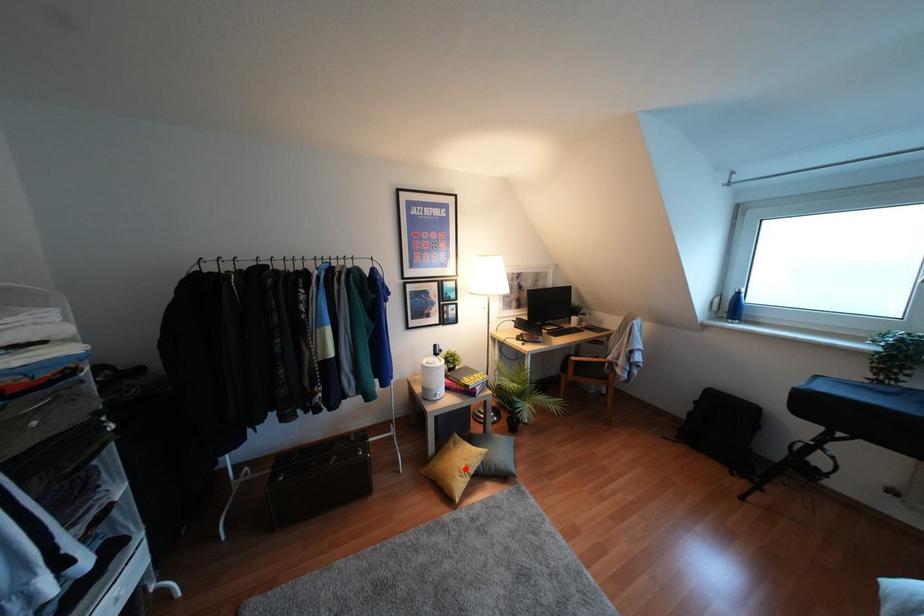
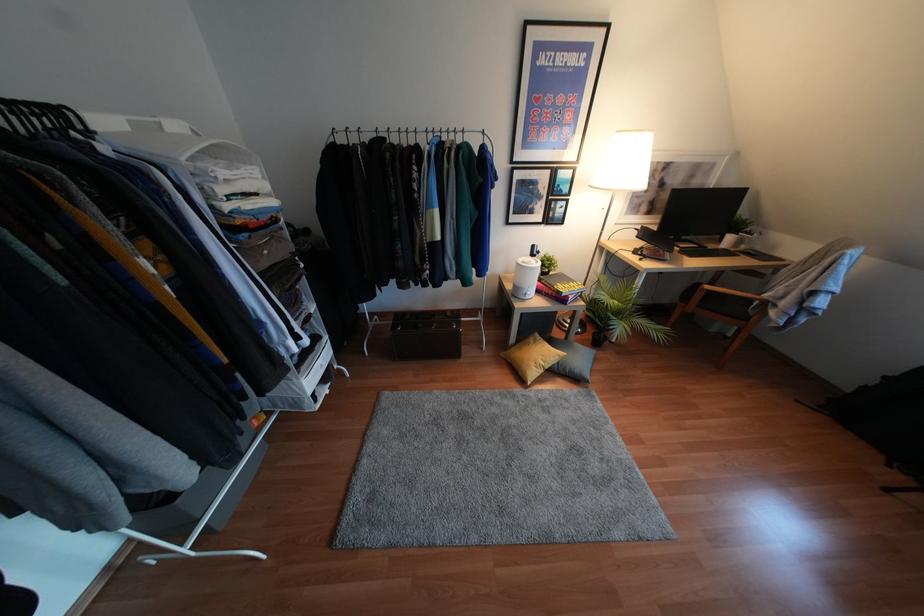
Question: A red point is marked in image1. In image2, is the corresponding 3D point closer to the camera or farther? Reply with the corresponding letter.

Choices:
 (A) The corresponding 3D point is closer.
 (B) The corresponding 3D point is farther.

Answer: (B)